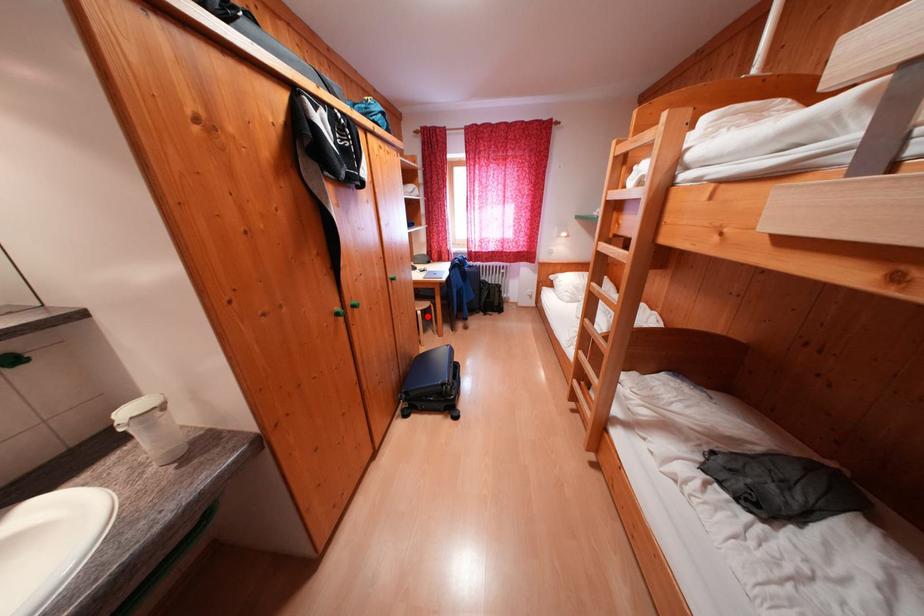
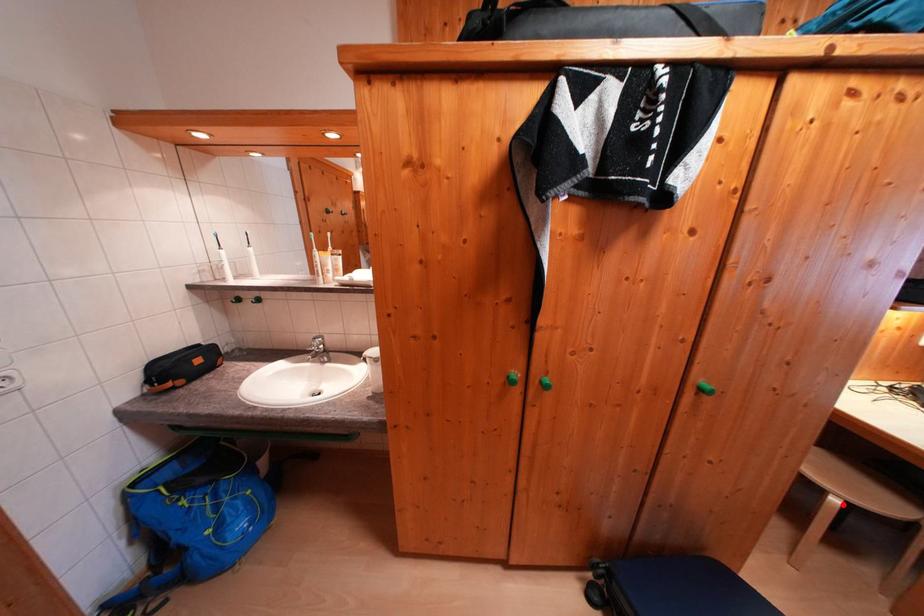
I am providing you with two images of the same scene from different viewpoints. A red point is marked on the first image and another point is marked on the second image. Does the point marked in image1 correspond to the same location as the one in image2?

Yes